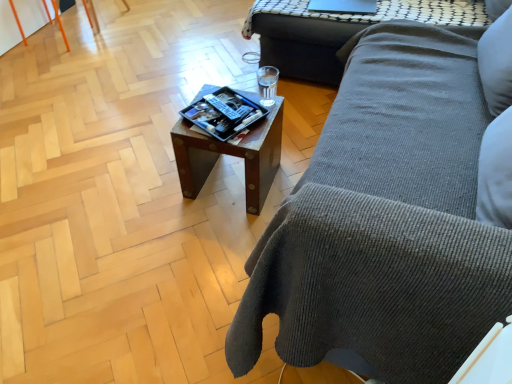
Question: Considering the positions of point (245, 177) and point (264, 49), is point (245, 177) closer or farther from the camera than point (264, 49)?

Choices:
 (A) farther
 (B) closer

Answer: (B)

Question: Is wooden tray at center, acting as the 2th table starting from the back, spatially inside wooden side table at upper right, the 1th table positioned from the right, or outside of it?

Choices:
 (A) outside
 (B) inside

Answer: (A)

Question: Which is nearer to the wooden side table at upper right, marked as the 2th table in a front-to-back arrangement?

Choices:
 (A) orange plastic chair at upper left
 (B) gray corduroy couch at center
 (C) wooden tray at center, acting as the 2th table starting from the right
 (D) matte black tray at center
 (E) sleek black laptop at upper center

Answer: (E)

Question: Estimate the real-world distances between objects in this image. Which object is farther from the matte black tray at center?

Choices:
 (A) sleek black laptop at upper center
 (B) orange plastic chair at upper left
 (C) wooden tray at center, the 1th table when ordered from left to right
 (D) wooden side table at upper right, the 1th table positioned from the right
 (E) gray corduroy couch at center

Answer: (B)